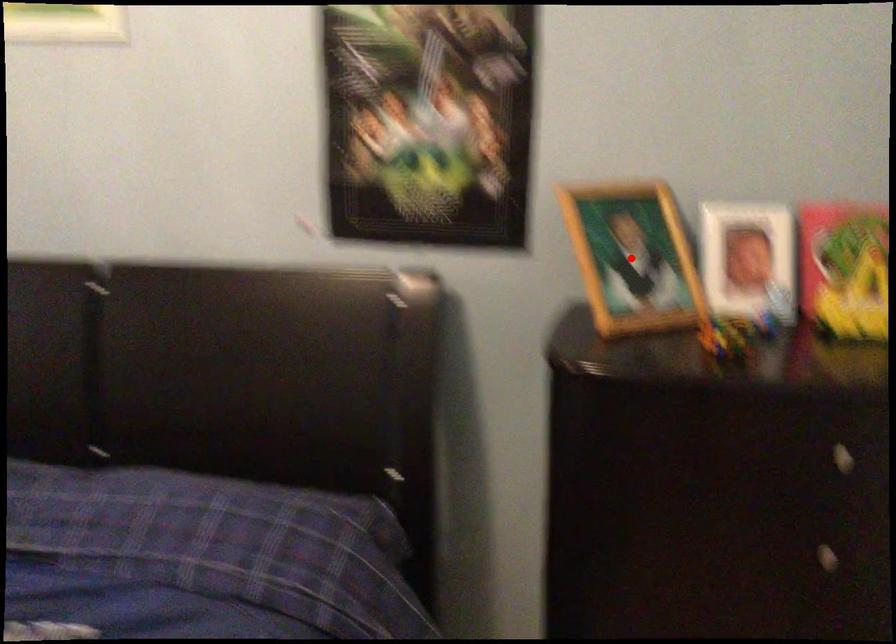
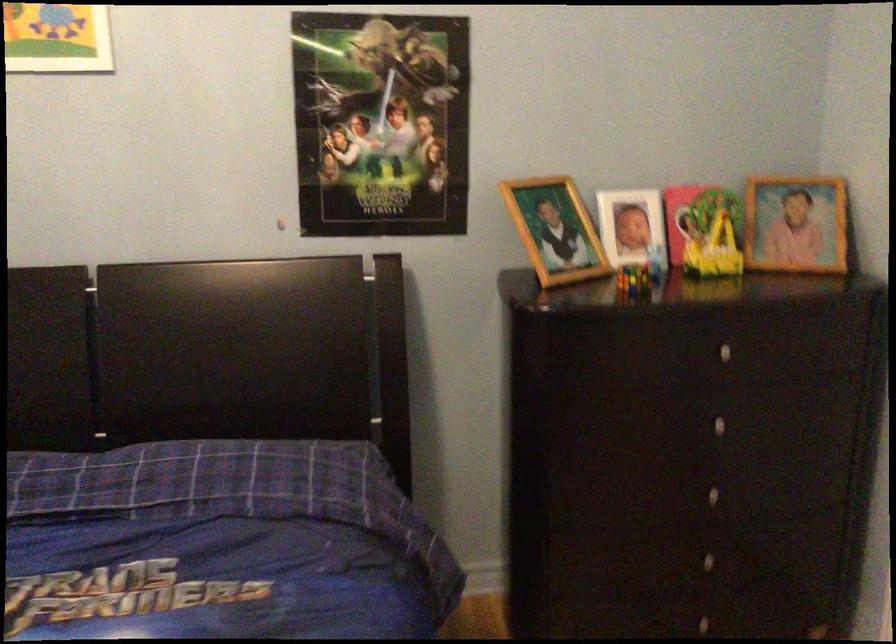
Question: I am providing you with two images of the same scene from different viewpoints. Given a red point in image1, look at the same physical point in image2. Is it:

Choices:
 (A) Closer to the viewpoint
 (B) Farther from the viewpoint

Answer: (B)